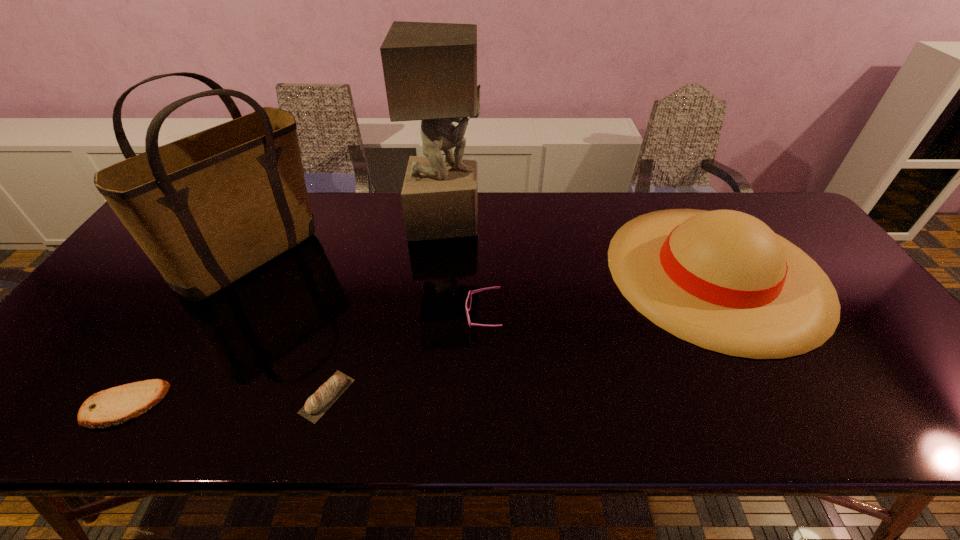
Where is `free region at the far edge of the desktop`? free region at the far edge of the desktop is located at coordinates (559, 215).

The width and height of the screenshot is (960, 540). In order to click on blank area at the near edge in this screenshot , I will do `click(622, 417)`.

This screenshot has height=540, width=960. What are the coordinates of `vacant space at the left edge` in the screenshot? It's located at (113, 309).

You are a GUI agent. You are given a task and a screenshot of the screen. Output one action in this format:
    pyautogui.click(x=<x>, y=<y>)
    Task: Click on the blank space at the far right corner
    The image size is (960, 540).
    Given the screenshot: What is the action you would take?
    [748, 211]

The height and width of the screenshot is (540, 960). What are the coordinates of `blank region between the third object from left to right and the left pita bread` in the screenshot? It's located at (226, 401).

Where is `free space between the tote bag and the sculpture`? The width and height of the screenshot is (960, 540). free space between the tote bag and the sculpture is located at coordinates (349, 238).

Locate an element on the screen. empty space that is in between the fourth shortest object and the sunglasses is located at coordinates (600, 294).

The width and height of the screenshot is (960, 540). I want to click on vacant space in between the rightmost object and the fourth tallest object, so click(x=600, y=294).

Identify the location of empty location between the fourth tallest object and the third object from left to right. The height and width of the screenshot is (540, 960). (405, 356).

Where is `blank region between the left pita bread and the rightmost object`? blank region between the left pita bread and the rightmost object is located at coordinates (420, 339).